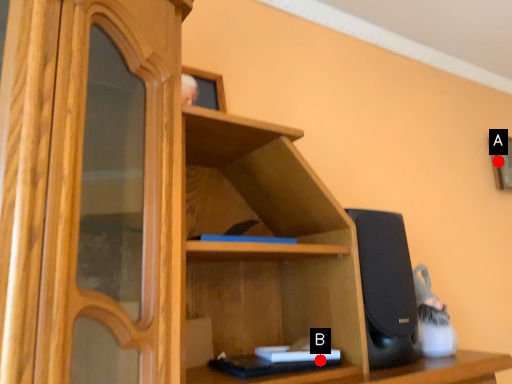
Question: Two points are circled on the image, labeled by A and B beside each circle. Which point appears farthest from the camera in this image?

Choices:
 (A) A is further
 (B) B is further

Answer: (A)